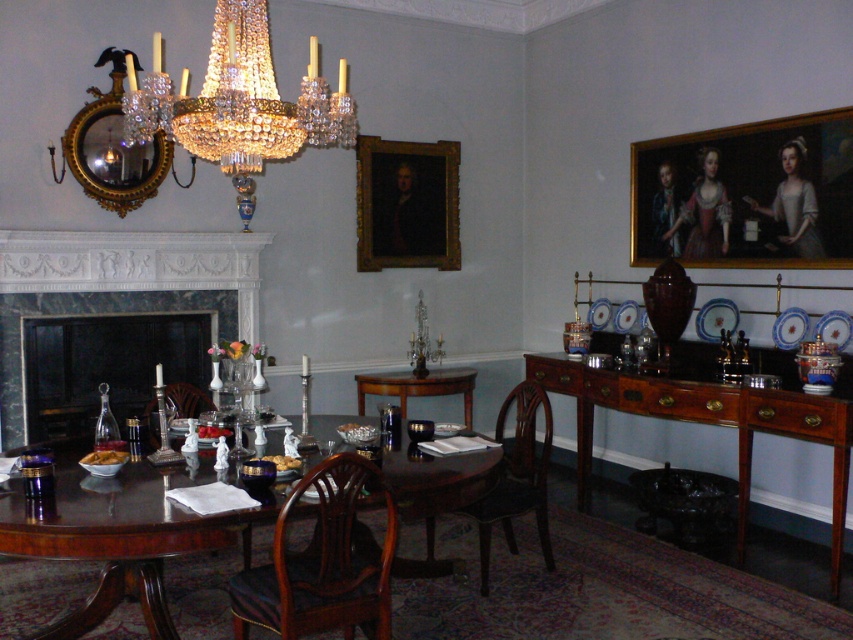
Question: Considering the relative positions of mahogany wood round table at center and mahogany wood sideboard at right in the image provided, where is mahogany wood round table at center located with respect to mahogany wood sideboard at right?

Choices:
 (A) left
 (B) right

Answer: (A)

Question: Which point is closer to the camera?

Choices:
 (A) wooden chair at table left
 (B) crystal/golden chandelier at upper center
 (C) mahogany wood chair at center

Answer: (B)

Question: Among these points, which one is farthest from the camera?

Choices:
 (A) (57, 531)
 (B) (795, 397)

Answer: (B)

Question: Does crystal/golden chandelier at upper center have a larger size compared to mahogany wood chair at center?

Choices:
 (A) no
 (B) yes

Answer: (A)

Question: Among these points, which one is nearest to the camera?

Choices:
 (A) (180, 268)
 (B) (402, 161)

Answer: (A)

Question: Can you confirm if mahogany wood round table at center is positioned above crystal/golden chandelier at upper center?

Choices:
 (A) no
 (B) yes

Answer: (A)